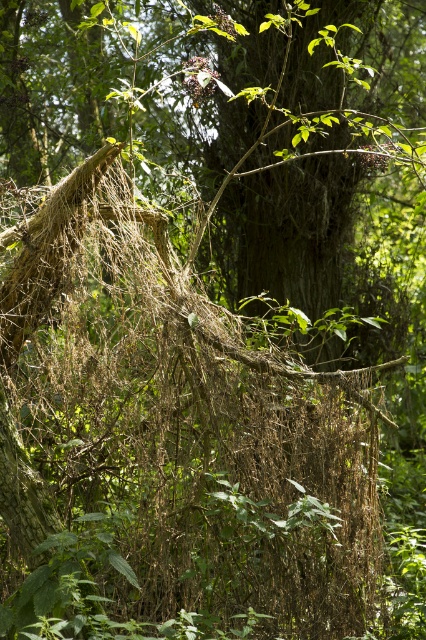
Question: Does brown dried grass at center have a larger size compared to brown rough bark tree trunk at center?

Choices:
 (A) yes
 (B) no

Answer: (A)

Question: Which of the following is the closest to the observer?

Choices:
 (A) brown rough bark tree trunk at center
 (B) brown dried grass at center

Answer: (B)

Question: Can you confirm if brown dried grass at center is positioned to the left of brown rough bark tree trunk at center?

Choices:
 (A) yes
 (B) no

Answer: (A)

Question: Is brown dried grass at center thinner than brown rough bark tree trunk at center?

Choices:
 (A) yes
 (B) no

Answer: (B)